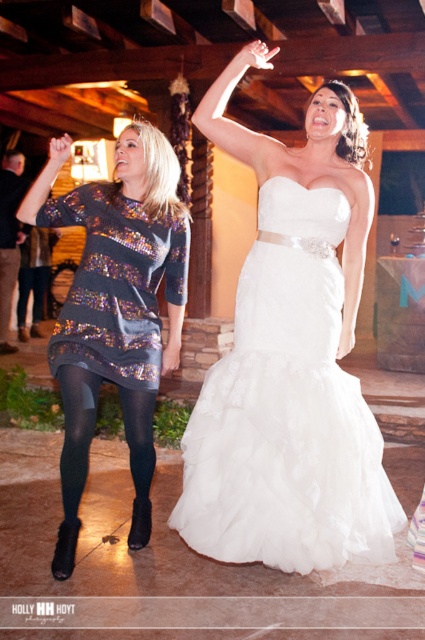
Question: Can you confirm if white satin dress at center is smaller than black tights at lower left?

Choices:
 (A) yes
 (B) no

Answer: (B)

Question: Among these objects, which one is nearest to the camera?

Choices:
 (A) black tights at lower left
 (B) white satin dress at center

Answer: (B)

Question: Does sparkly sequin dress at left come in front of black tights at lower left?

Choices:
 (A) yes
 (B) no

Answer: (A)

Question: Which of the following is the farthest from the observer?

Choices:
 (A) white satin dress at center
 (B) sparkly sequin dress at left
 (C) black tights at lower left

Answer: (C)

Question: Is sparkly sequin dress at left smaller than black tights at lower left?

Choices:
 (A) yes
 (B) no

Answer: (B)

Question: Which of the following is the farthest from the observer?

Choices:
 (A) sparkly sequin dress at left
 (B) black tights at lower left

Answer: (B)